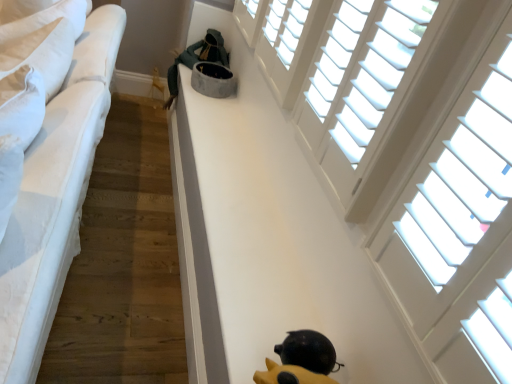
Question: Is white wood blinds at upper right, acting as the 1th window starting from the front, positioned with its back to yellow rubber duck at lower center?

Choices:
 (A) no
 (B) yes

Answer: (A)

Question: Does white wood blinds at upper right, acting as the 1th window starting from the front, have a smaller size compared to yellow rubber duck at lower center?

Choices:
 (A) no
 (B) yes

Answer: (A)

Question: Can you confirm if white wood blinds at upper right, acting as the 1th window starting from the front, is bigger than yellow rubber duck at lower center?

Choices:
 (A) yes
 (B) no

Answer: (A)

Question: Is white wood blinds at upper right, marked as the second window in a back-to-front arrangement, taller than yellow rubber duck at lower center?

Choices:
 (A) yes
 (B) no

Answer: (A)

Question: Is white wood blinds at upper right, acting as the 1th window starting from the front, touching yellow rubber duck at lower center?

Choices:
 (A) no
 (B) yes

Answer: (A)

Question: Looking at their shapes, would you say dark gray plush cat bed at upper center is wider or thinner than white wood blinds at upper right, which is counted as the first window, starting from the back?

Choices:
 (A) thin
 (B) wide

Answer: (B)

Question: From a real-world perspective, is dark gray plush cat bed at upper center above or below white wood blinds at upper right, which is counted as the first window, starting from the back?

Choices:
 (A) above
 (B) below

Answer: (B)

Question: Considering the positions of dark gray plush cat bed at upper center and white wood blinds at upper right, which is counted as the first window, starting from the back, in the image, is dark gray plush cat bed at upper center bigger or smaller than white wood blinds at upper right, which is counted as the first window, starting from the back,?

Choices:
 (A) big
 (B) small

Answer: (A)

Question: From their relative heights in the image, would you say dark gray plush cat bed at upper center is taller or shorter than white wood blinds at upper right, which is the second window in front-to-back order?

Choices:
 (A) short
 (B) tall

Answer: (B)

Question: Is point (309, 339) positioned closer to the camera than point (30, 337)?

Choices:
 (A) closer
 (B) farther

Answer: (B)

Question: Looking at the image, does yellow rubber duck at lower center seem bigger or smaller compared to white fabric bed at left?

Choices:
 (A) small
 (B) big

Answer: (A)

Question: From the image's perspective, relative to white fabric bed at left, is yellow rubber duck at lower center above or below?

Choices:
 (A) above
 (B) below

Answer: (B)

Question: From their relative heights in the image, would you say yellow rubber duck at lower center is taller or shorter than white fabric bed at left?

Choices:
 (A) tall
 (B) short

Answer: (B)

Question: Is white wood blinds at upper right, which is counted as the first window, starting from the back, inside the boundaries of white wood blinds at upper right, marked as the second window in a back-to-front arrangement, or outside?

Choices:
 (A) inside
 (B) outside

Answer: (B)

Question: From a real-world perspective, is white wood blinds at upper right, which is counted as the first window, starting from the back, above or below white wood blinds at upper right, acting as the 1th window starting from the front?

Choices:
 (A) above
 (B) below

Answer: (B)